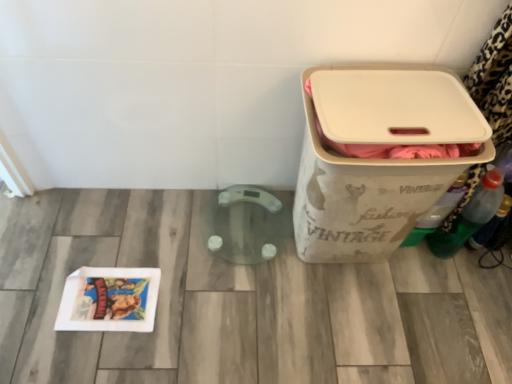
At what (x,y) coordinates should I click in order to perform the action: click on vacant area that lies in front of beige fabric storage bin at right. Please return your answer as a coordinate pair (x, y). The width and height of the screenshot is (512, 384). Looking at the image, I should click on (343, 327).